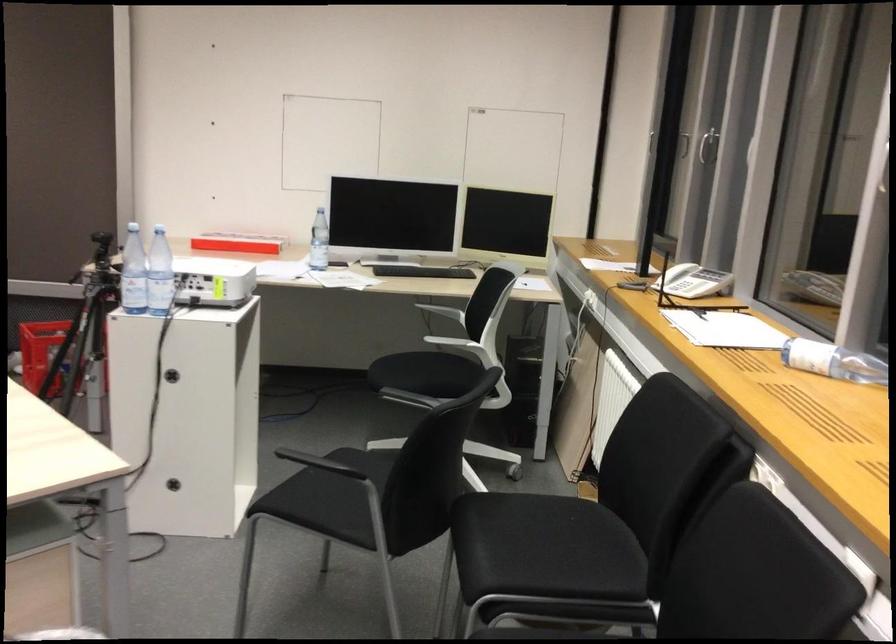
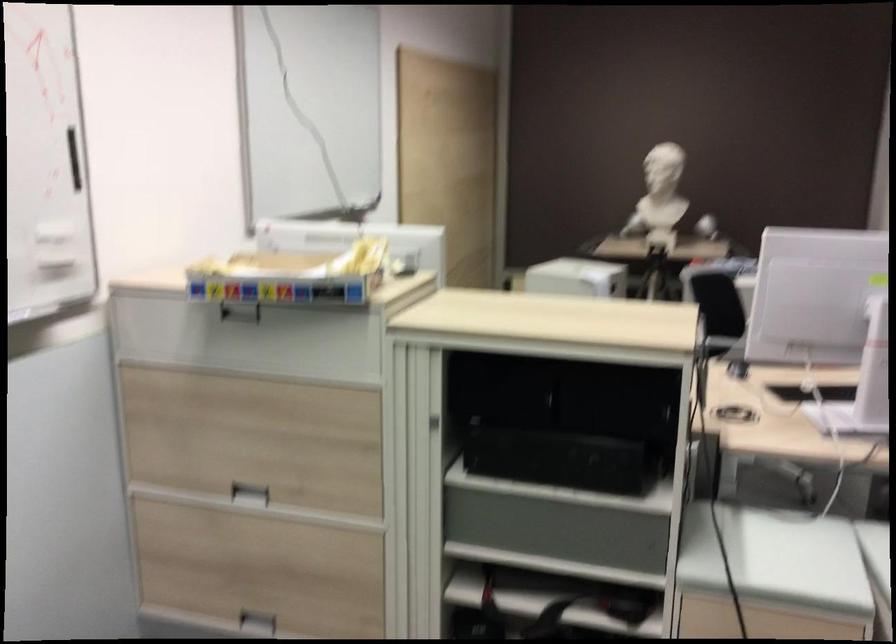
Consider the image. The images are taken continuously from a first-person perspective. In which direction are you moving?

The cameraman moved toward left, backward.